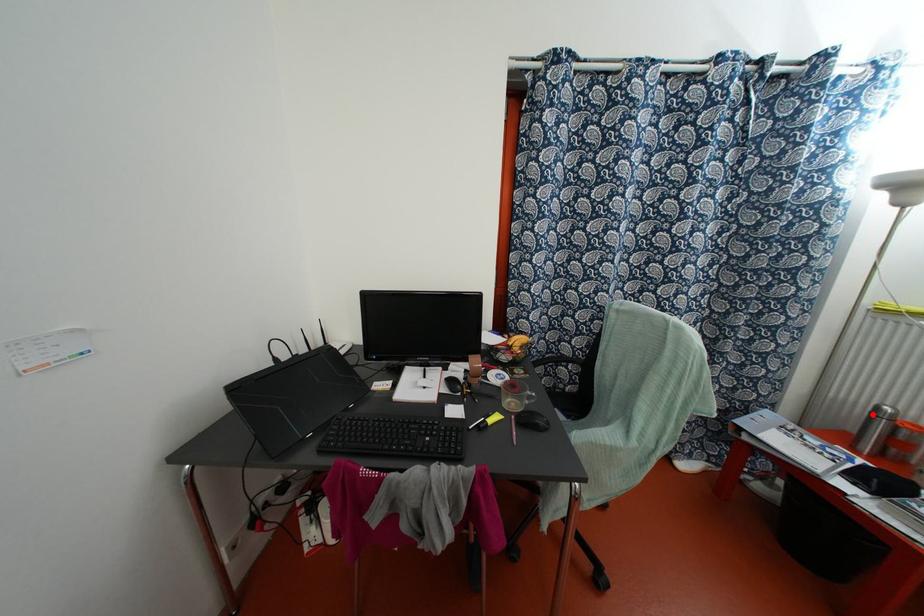
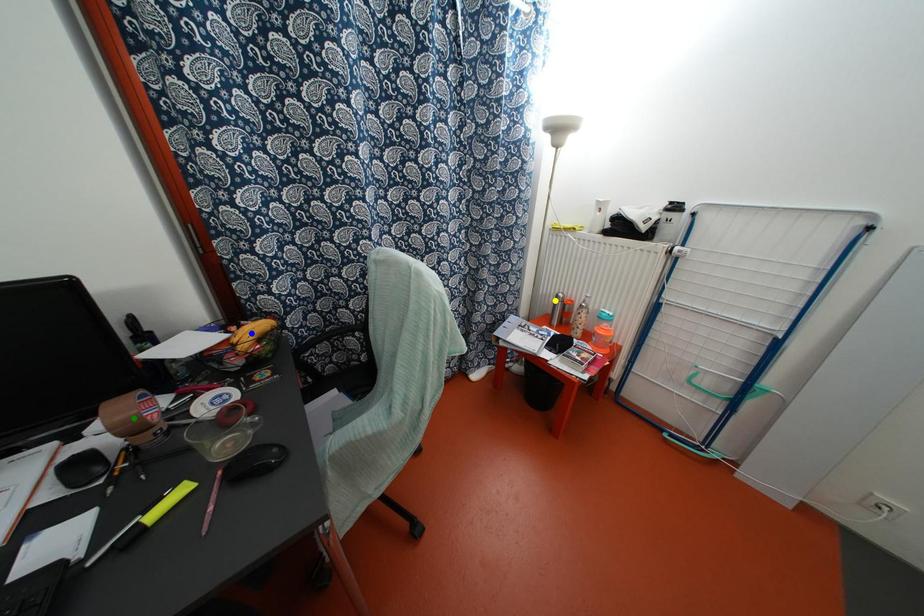
Question: I am providing you with two images of the same scene from different viewpoints. A red point is marked on the first image. You are given multiple points on the second image. Which spot in image 2 lines up with the point in image 1?

Choices:
 (A) yellow point
 (B) blue point
 (C) green point

Answer: (A)